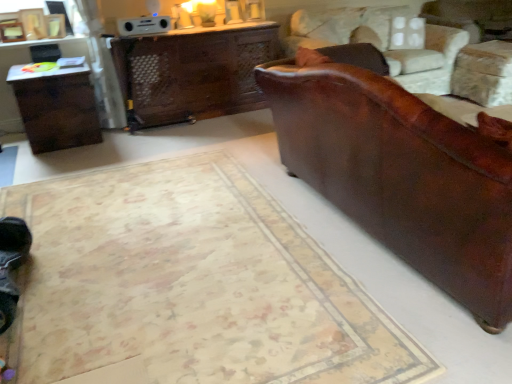
What do you see at coordinates (56, 107) in the screenshot? I see `dark brown wood table at left` at bounding box center [56, 107].

The image size is (512, 384). What do you see at coordinates (401, 170) in the screenshot? I see `leather couch at right` at bounding box center [401, 170].

The width and height of the screenshot is (512, 384). I want to click on brown leather swivel chair at right, so click(x=429, y=60).

Consider the image. From a real-world perspective, which object rests below the other?

dark brown wood table at left is physically lower.

Can you confirm if brown leather swivel chair at right is taller than dark brown wood table at left?

Correct, brown leather swivel chair at right is much taller as dark brown wood table at left.

Between brown leather swivel chair at right and dark brown wood table at left, which one has smaller size?

dark brown wood table at left.

Considering the positions of objects brown leather swivel chair at right and dark brown wood table at left in the image provided, who is in front, brown leather swivel chair at right or dark brown wood table at left?

→ dark brown wood table at left is more forward.

Considering the positions of objects dark brown wood table at left and beige carpet at lower right in the image provided, who is more to the right, dark brown wood table at left or beige carpet at lower right?

Positioned to the right is beige carpet at lower right.

Is dark brown wood table at left looking in the opposite direction of beige carpet at lower right?

dark brown wood table at left is not turned away from beige carpet at lower right.

Is beige carpet at lower right a part of dark brown wood table at left?

That's incorrect, beige carpet at lower right is not inside dark brown wood table at left.

Between point (40, 107) and point (201, 294), which one is positioned in front?

The point (201, 294) is in front.

Is brown leather swivel chair at right oriented away from leather couch at right?

That's not correct — brown leather swivel chair at right is not looking away from leather couch at right.

Considering the points (339, 20) and (344, 153), which point is in front, point (339, 20) or point (344, 153)?

The point (344, 153) is closer.

Is brown leather swivel chair at right next to leather couch at right?

No, brown leather swivel chair at right is not beside leather couch at right.

Locate an element on the screen. swivel chair on the right of leather couch at right is located at coordinates (429, 60).

From a real-world perspective, is beige carpet at lower right above or below wooden desk at center?

From a real-world perspective, beige carpet at lower right is physically below wooden desk at center.

From the picture: Considering the positions of objects beige carpet at lower right and wooden desk at center in the image provided, who is more to the left, beige carpet at lower right or wooden desk at center?

wooden desk at center is more to the left.

Is beige carpet at lower right inside or outside of wooden desk at center?

beige carpet at lower right is outside wooden desk at center.

From the image's perspective, relative to wooden desk at center, is beige carpet at lower right above or below?

From the image's perspective, beige carpet at lower right appears below wooden desk at center.

Would you say wooden desk at center is inside or outside leather couch at right?

wooden desk at center is located beyond the bounds of leather couch at right.

Considering the sizes of objects wooden desk at center and leather couch at right in the image provided, who is thinner, wooden desk at center or leather couch at right?

wooden desk at center.

Is wooden desk at center oriented towards leather couch at right?

Yes, wooden desk at center is facing leather couch at right.

Which is more to the right, wooden desk at center or leather couch at right?

leather couch at right is more to the right.

From a real-world perspective, is beige carpet at lower right positioned above or below brown leather swivel chair at right?

Clearly, from a real-world perspective, beige carpet at lower right is below brown leather swivel chair at right.

Identify the location of mat lying in front of the brown leather swivel chair at right. The width and height of the screenshot is (512, 384). (191, 284).

Consider the image. In terms of width, does beige carpet at lower right look wider or thinner when compared to brown leather swivel chair at right?

beige carpet at lower right is wider than brown leather swivel chair at right.

Which point is more forward, (x=290, y=122) or (x=153, y=72)?

The point (x=290, y=122) is more forward.

Is leather couch at right positioned beyond the bounds of wooden desk at center?

Yes.

From a real-world perspective, is leather couch at right under wooden desk at center?

Actually, leather couch at right is physically above wooden desk at center in the real world.

This screenshot has height=384, width=512. Find the location of `table below the brown leather swivel chair at right (from the image's perspective)`. table below the brown leather swivel chair at right (from the image's perspective) is located at coordinates (56, 107).

The height and width of the screenshot is (384, 512). In order to click on table behind the beige carpet at lower right in this screenshot , I will do `click(56, 107)`.

Which object lies further to the anchor point dark brown wood table at left, leather couch at right or brown leather swivel chair at right?

Based on the image, brown leather swivel chair at right appears to be further to dark brown wood table at left.

Looking at the image, which one is located further to wooden desk at center, brown leather swivel chair at right or dark brown wood table at left?

The object further to wooden desk at center is brown leather swivel chair at right.

Looking at the image, which one is located closer to beige carpet at lower right, dark brown wood table at left or brown leather swivel chair at right?

Among the two, dark brown wood table at left is located nearer to beige carpet at lower right.

From the image, which object appears to be nearer to brown leather swivel chair at right, wooden desk at center or dark brown wood table at left?

wooden desk at center.

Considering their positions, is brown leather swivel chair at right positioned further to dark brown wood table at left than leather couch at right?

Among the two, brown leather swivel chair at right is located further to dark brown wood table at left.

Based on their spatial positions, is dark brown wood table at left or brown leather swivel chair at right closer to wooden desk at center?

Based on the image, dark brown wood table at left appears to be nearer to wooden desk at center.

Based on their spatial positions, is dark brown wood table at left or wooden desk at center further from beige carpet at lower right?

Based on the image, wooden desk at center appears to be further to beige carpet at lower right.

Based on the photo, when comparing their distances from wooden desk at center, does leather couch at right or beige carpet at lower right seem further?

Based on the image, beige carpet at lower right appears to be further to wooden desk at center.

Find the location of a particular element. This screenshot has width=512, height=384. studio couch between beige carpet at lower right and brown leather swivel chair at right in the front-back direction is located at coordinates (401, 170).

Identify the location of swivel chair between beige carpet at lower right and wooden desk at center along the z-axis. The width and height of the screenshot is (512, 384). (429, 60).

Find the location of a particular element. The height and width of the screenshot is (384, 512). swivel chair between leather couch at right and wooden desk at center along the z-axis is located at coordinates [x=429, y=60].

Identify the location of studio couch between dark brown wood table at left and brown leather swivel chair at right from left to right. (401, 170).